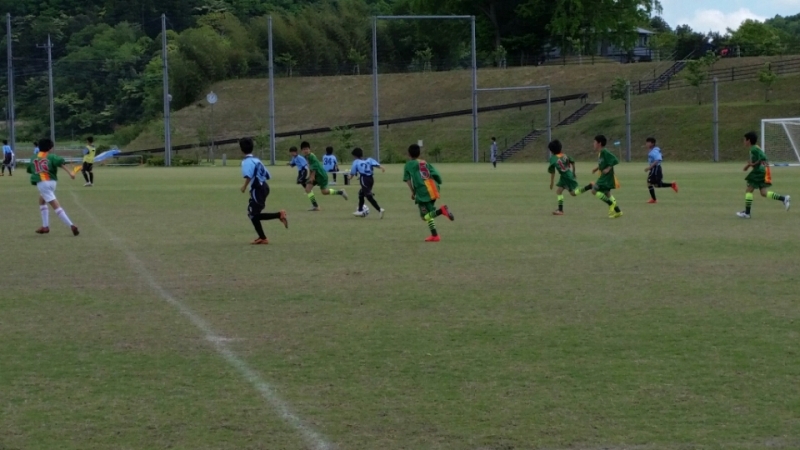
Where is `top of staircase`? This screenshot has width=800, height=450. top of staircase is located at coordinates (688, 59).